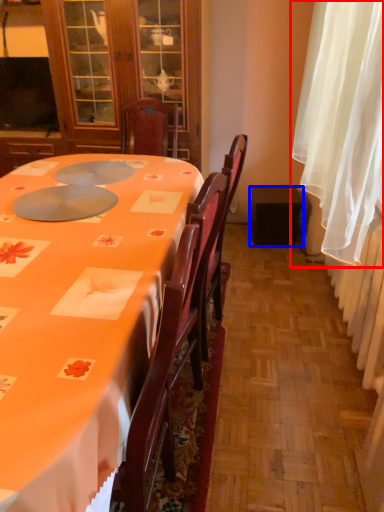
Question: Which of the following is the closest to the observer, curtain (highlighted by a red box) or loudspeaker (highlighted by a blue box)?

Choices:
 (A) curtain
 (B) loudspeaker

Answer: (A)